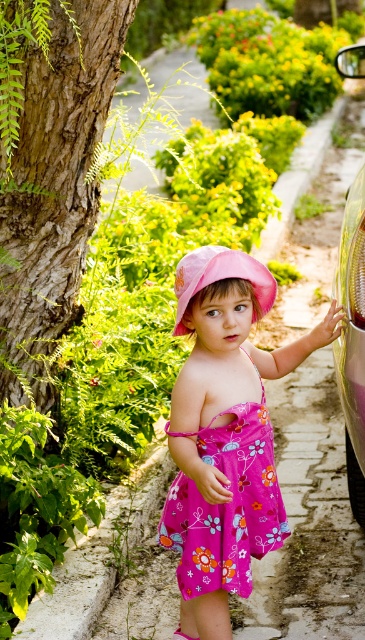
Question: Does pink floral dress at center have a smaller size compared to pink fabric hat at center?

Choices:
 (A) no
 (B) yes

Answer: (A)

Question: Which object is the closest to the shiny metallic car at right?

Choices:
 (A) pink floral dress at center
 (B) pink fabric hat at center
 (C) floral-patterned fabric dress at center

Answer: (A)

Question: Which point is farther to the camera?

Choices:
 (A) (223, 556)
 (B) (224, 278)
 (C) (270, 289)

Answer: (A)

Question: Can you confirm if floral-patterned fabric dress at center is positioned to the left of pink fabric hat at center?

Choices:
 (A) no
 (B) yes

Answer: (A)

Question: Which object is farther from the camera taking this photo?

Choices:
 (A) pink floral dress at center
 (B) pink fabric hat at center
 (C) shiny metallic car at right

Answer: (C)

Question: Considering the relative positions of floral-patterned fabric dress at center and shiny metallic car at right in the image provided, where is floral-patterned fabric dress at center located with respect to shiny metallic car at right?

Choices:
 (A) left
 (B) right

Answer: (A)